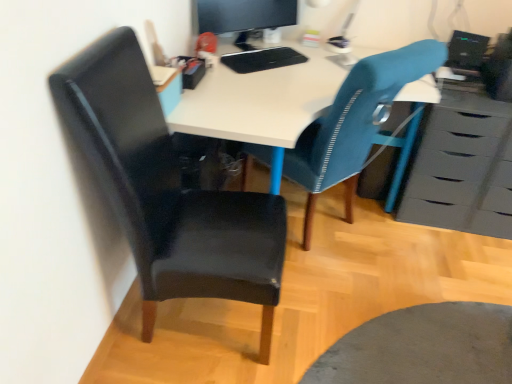
Question: Does black glossy computer at upper right have a greater width compared to black leather chair at left, the second chair in the right-to-left sequence?

Choices:
 (A) yes
 (B) no

Answer: (B)

Question: Is the position of black glossy computer at upper right less distant than that of black leather chair at left, acting as the 1th chair starting from the left?

Choices:
 (A) yes
 (B) no

Answer: (B)

Question: Is black glossy computer at upper right smaller than black leather chair at left, acting as the 1th chair starting from the left?

Choices:
 (A) yes
 (B) no

Answer: (A)

Question: Is black glossy computer at upper right oriented towards black leather chair at left, acting as the 1th chair starting from the left?

Choices:
 (A) no
 (B) yes

Answer: (B)

Question: Is black glossy computer at upper right beside black leather chair at left, acting as the 1th chair starting from the left?

Choices:
 (A) yes
 (B) no

Answer: (B)

Question: From the image's perspective, is black leather chair at left, the second chair in the right-to-left sequence, positioned above or below textured blue chair at center, arranged as the 1th chair when viewed from the right?

Choices:
 (A) below
 (B) above

Answer: (A)

Question: Visually, is black leather chair at left, the second chair in the right-to-left sequence, positioned to the left or to the right of textured blue chair at center, arranged as the 1th chair when viewed from the right?

Choices:
 (A) left
 (B) right

Answer: (A)

Question: Considering the positions of point (177, 256) and point (360, 114), is point (177, 256) closer or farther from the camera than point (360, 114)?

Choices:
 (A) closer
 (B) farther

Answer: (A)

Question: Looking at their shapes, would you say black leather chair at left, acting as the 1th chair starting from the left, is wider or thinner than textured blue chair at center, arranged as the 1th chair when viewed from the right?

Choices:
 (A) thin
 (B) wide

Answer: (A)

Question: From a real-world perspective, is textured blue chair at center, the 2th chair positioned from the left, above or below matte black monitor at upper center?

Choices:
 (A) below
 (B) above

Answer: (A)

Question: Considering the positions of point (351, 193) and point (246, 3), is point (351, 193) closer or farther from the camera than point (246, 3)?

Choices:
 (A) farther
 (B) closer

Answer: (B)

Question: Is textured blue chair at center, arranged as the 1th chair when viewed from the right, inside or outside of matte black monitor at upper center?

Choices:
 (A) outside
 (B) inside

Answer: (A)

Question: Visually, is textured blue chair at center, arranged as the 1th chair when viewed from the right, positioned to the left or to the right of matte black monitor at upper center?

Choices:
 (A) left
 (B) right

Answer: (B)

Question: Is textured blue chair at center, the 2th chair positioned from the left, taller or shorter than matte gray chest of drawers at right?

Choices:
 (A) tall
 (B) short

Answer: (A)

Question: From a real-world perspective, relative to matte gray chest of drawers at right, is textured blue chair at center, the 2th chair positioned from the left, vertically above or below?

Choices:
 (A) above
 (B) below

Answer: (A)